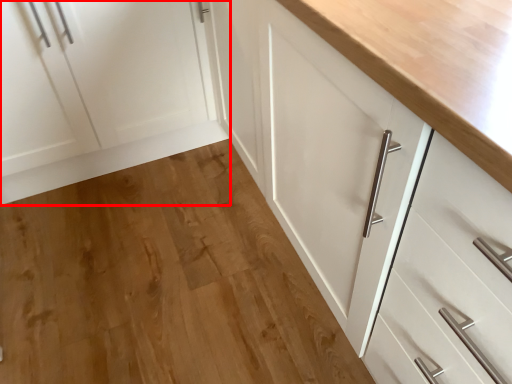
Question: From the image's perspective, where is cabinetry (annotated by the red box) located relative to hardwood?

Choices:
 (A) above
 (B) below

Answer: (A)